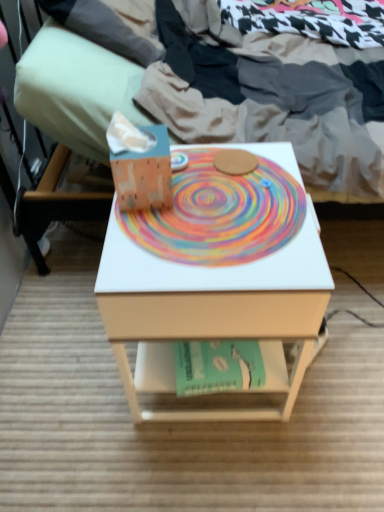
The image size is (384, 512). I want to click on empty space that is ontop of white matte desk at center, so click(220, 204).